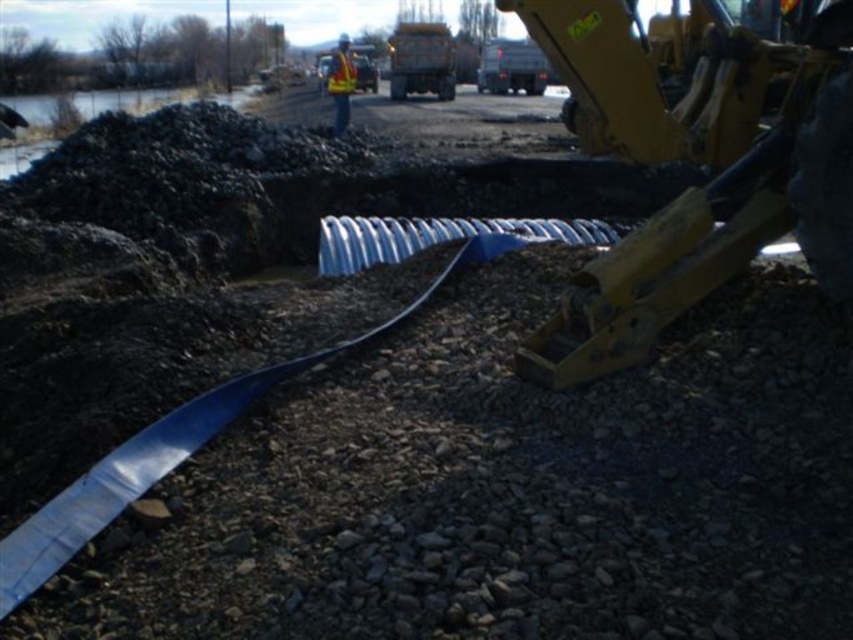
You are a construction worker standing at the origin point of the image. You need to place a new safety cone exactly 0.3 units to the right of the gray gravel at center. Where should you place the safety cone in 2D coordinates?

The gray gravel at center is located at point (506,486). To place the safety cone 0.3 units to the right, add 0.3 to the x coordinate. The new coordinates would be (506,639).

You are a safety inspector at the construction site. You notice the yellow metallic excavator at center right and the yellow reflective vest at center. According to safety protocols, the excavator should be positioned to the left of the reflective vest to avoid blocking the emergency exit. Is the current positioning compliant with safety standards?

The yellow metallic excavator at center right is to the right of the yellow reflective vest at center, which means it is not positioned to the left of the reflective vest as required. This violates safety protocols, so the positioning is not compliant.